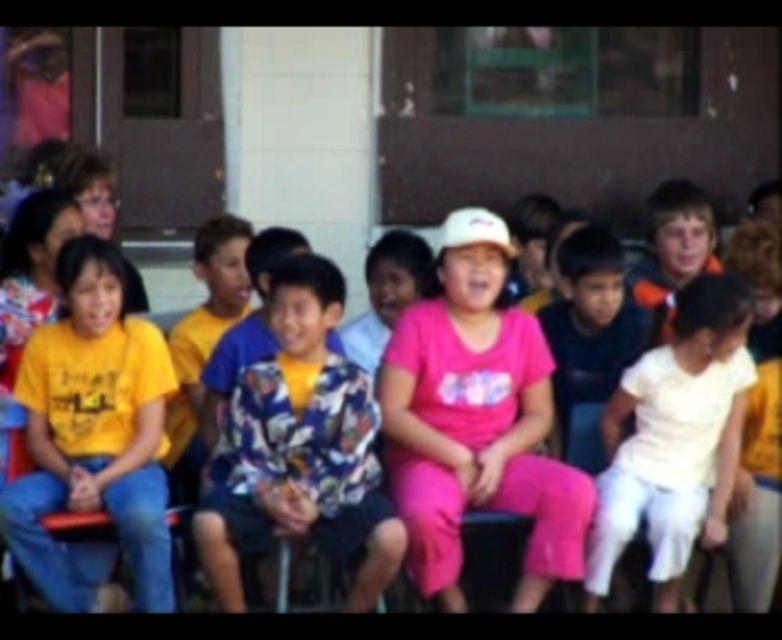
You are a photographer trying to capture a detailed shot of two specific points in the scene. The first point is at coordinate point (126, 490) and the second is at point (725, 508). If you want to focus on the point closer to you, which coordinate should you aim your camera at?

Point (126, 490) is closer to the viewer than point (725, 508), so you should aim your camera at point (126, 490) to focus on the closer point.

You are a photographer trying to capture a group photo of the children. You notice the yellow matte shirt at left and the white cotton shirt at right. Which child should you ask to adjust their position so that both shirts are at the same height in the photo?

You should ask the child wearing the white cotton shirt at right to stand up or move closer to the camera so that the white cotton shirt at right reaches the same height as the yellow matte shirt at left.

You are a photographer taking a picture of the scene. You need to focus on the two points in the image labeled as point (368,419) and point (612,552). Which point should you focus on first if you want to ensure the closest object is in focus?

You should focus on point (368,419) first because it is closer to the camera than point (612,552).